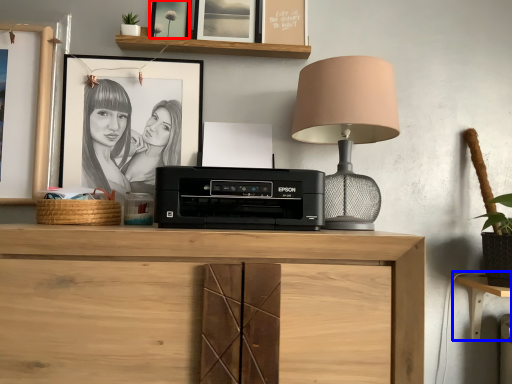
Question: Which of the following is the closest to the observer, picture frame (highlighted by a red box) or computer desk (highlighted by a blue box)?

Choices:
 (A) picture frame
 (B) computer desk

Answer: (B)